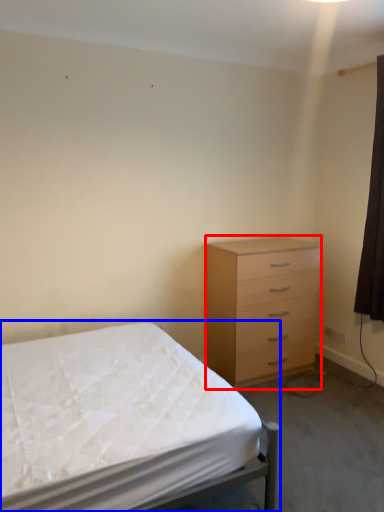
Question: Which point is closer to the camera, chest of drawers (highlighted by a red box) or bed (highlighted by a blue box)?

Choices:
 (A) chest of drawers
 (B) bed

Answer: (B)